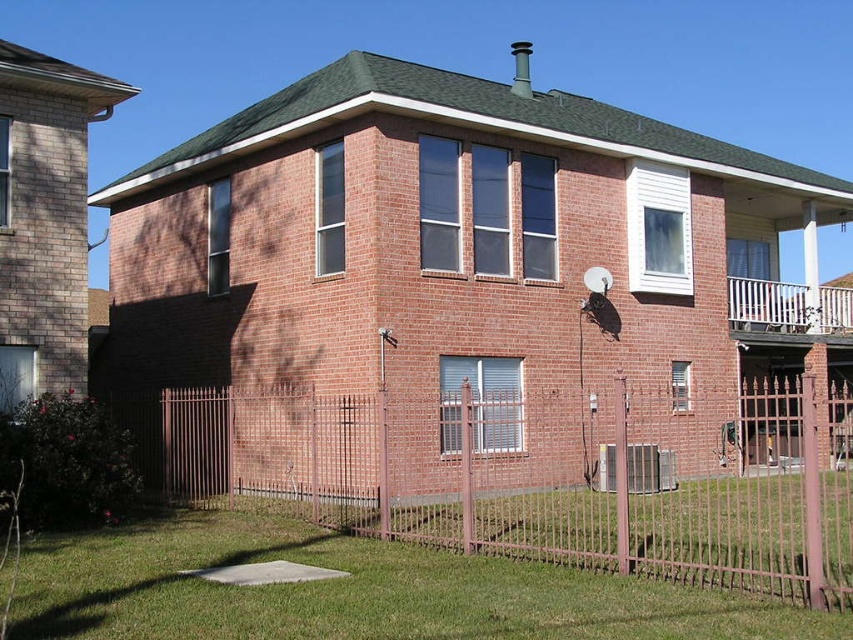
Question: Estimate the real-world distances between objects in this image. Which object is farther from the brown wrought iron fence at lower center?

Choices:
 (A) metallic silver basketball hoop at upper right
 (B) green grass at lower center

Answer: (B)

Question: Which point is farther to the camera?

Choices:
 (A) metallic silver basketball hoop at upper right
 (B) brown wrought iron fence at lower center
 (C) green grass at lower center

Answer: (A)

Question: Is brown wrought iron fence at lower center to the left of green grass at lower center from the viewer's perspective?

Choices:
 (A) yes
 (B) no

Answer: (B)

Question: Can you confirm if brown wrought iron fence at lower center is positioned below metallic silver basketball hoop at upper right?

Choices:
 (A) no
 (B) yes

Answer: (B)

Question: Which of the following is the closest to the observer?

Choices:
 (A) (595, 300)
 (B) (148, 525)
 (C) (634, 416)

Answer: (B)

Question: Does brown wrought iron fence at lower center have a lesser width compared to metallic silver basketball hoop at upper right?

Choices:
 (A) yes
 (B) no

Answer: (B)